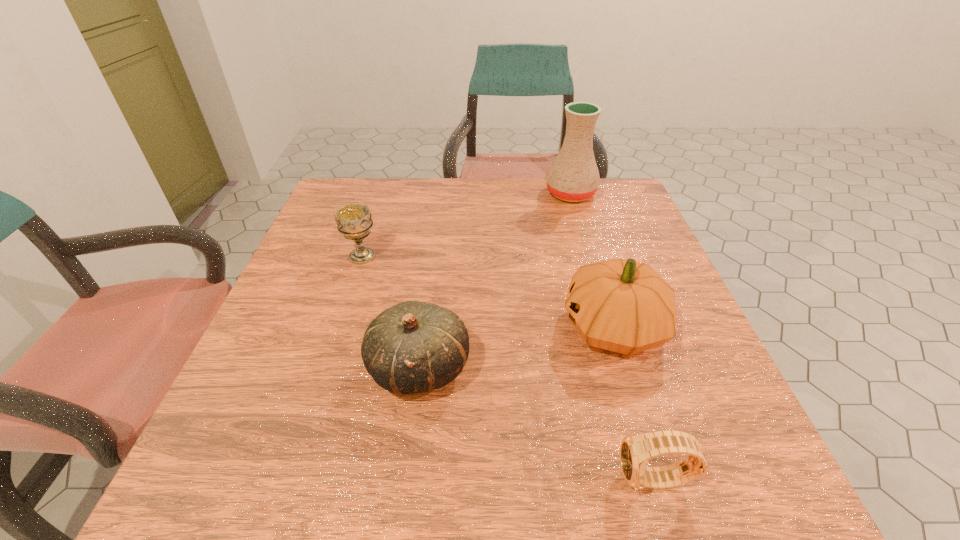
The height and width of the screenshot is (540, 960). In order to click on free space located 0.260m on the left of the pottery in this screenshot , I will do `click(455, 193)`.

You are a GUI agent. You are given a task and a screenshot of the screen. Output one action in this format:
    pyautogui.click(x=<x>, y=<y>)
    Task: Click on the free space located on the side of the fourth shortest object with the carved face
    The height and width of the screenshot is (540, 960).
    Given the screenshot: What is the action you would take?
    coord(387,328)

Where is `free space located 0.370m on the side of the fourth shortest object with the carved face`? free space located 0.370m on the side of the fourth shortest object with the carved face is located at coordinates (377, 328).

Where is `vacant space situated 0.370m on the side of the fourth shortest object with the carved face`? The width and height of the screenshot is (960, 540). vacant space situated 0.370m on the side of the fourth shortest object with the carved face is located at coordinates (377, 328).

The width and height of the screenshot is (960, 540). What are the coordinates of `vacant space located 0.100m on the left of the left gourd` in the screenshot? It's located at (314, 368).

Identify the location of vacant space located 0.120m on the right of the fourth nearest object. (428, 256).

Where is `vacant space situated 0.050m on the face of the nearest object`? This screenshot has height=540, width=960. vacant space situated 0.050m on the face of the nearest object is located at coordinates (586, 481).

In order to click on vacant space located 0.230m on the face of the nearest object in this screenshot , I will do `click(465, 481)`.

Where is `free spot located on the face of the nearest object`? The width and height of the screenshot is (960, 540). free spot located on the face of the nearest object is located at coordinates (419, 481).

You are a GUI agent. You are given a task and a screenshot of the screen. Output one action in this format:
    pyautogui.click(x=<x>, y=<y>)
    Task: Click on the object that is at the far edge
    This screenshot has height=540, width=960.
    Given the screenshot: What is the action you would take?
    pyautogui.click(x=573, y=176)